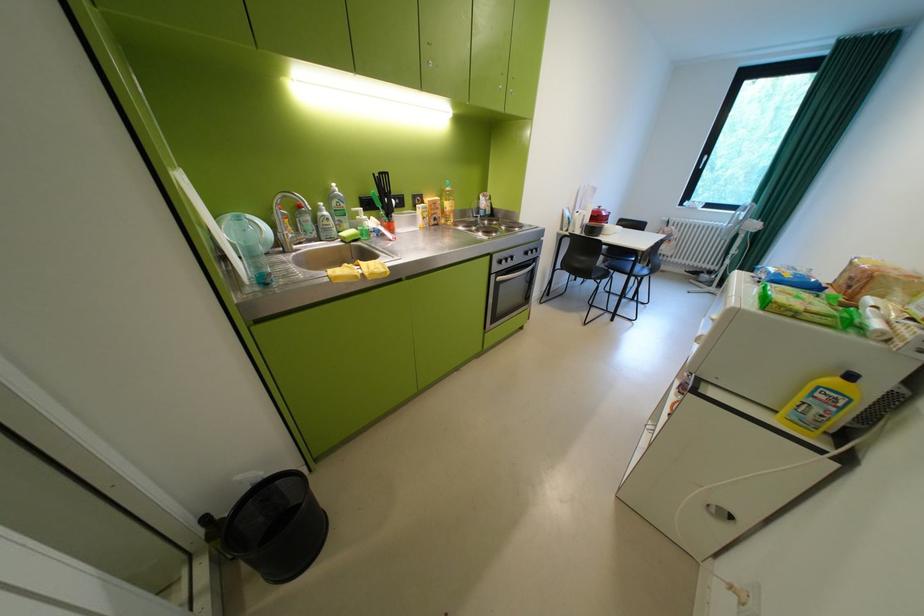
Where is `oven door handle`? oven door handle is located at coordinates (506, 306).